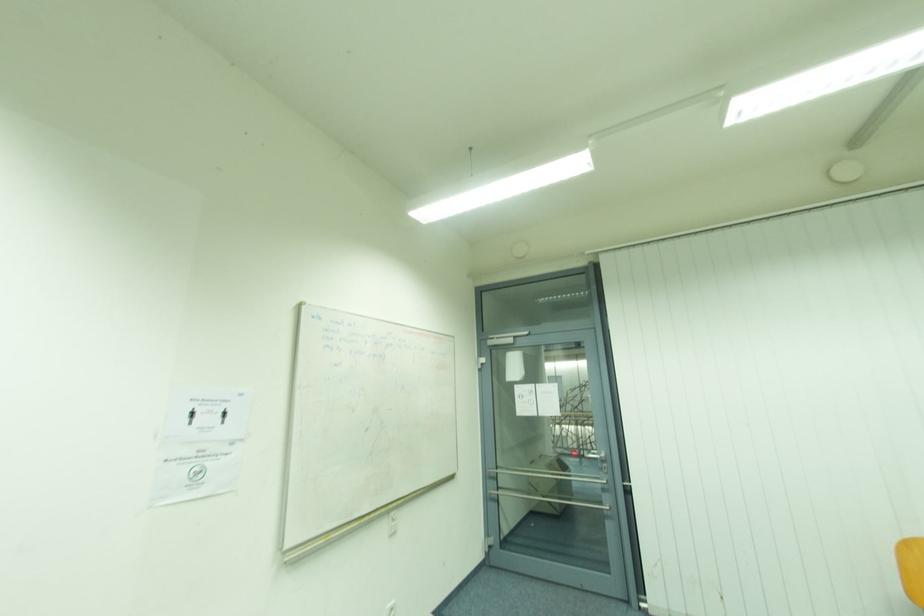
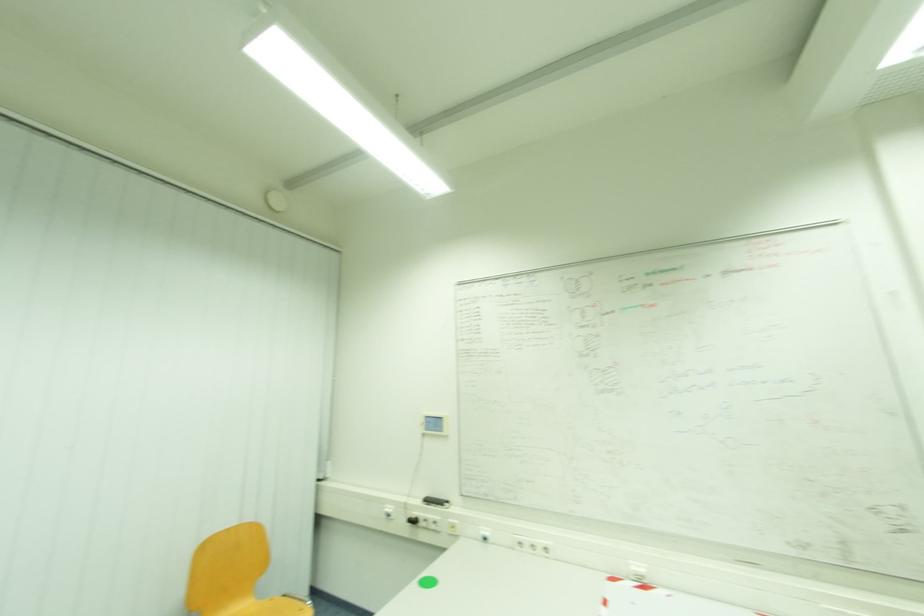
Question: How did the camera likely rotate?

Choices:
 (A) Left
 (B) Right
 (C) Up
 (D) Down

Answer: (B)